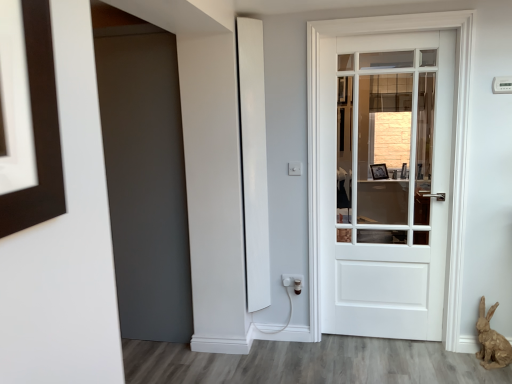
Question: Does brown papier-mâché rabbit at lower right have a smaller size compared to white plastic electric outlet at lower center?

Choices:
 (A) no
 (B) yes

Answer: (A)

Question: Could you tell me if brown papier-mâché rabbit at lower right is turned towards white plastic electric outlet at lower center?

Choices:
 (A) no
 (B) yes

Answer: (A)

Question: Considering the relative positions of brown papier-mâché rabbit at lower right and white plastic electric outlet at lower center in the image provided, is brown papier-mâché rabbit at lower right to the left of white plastic electric outlet at lower center from the viewer's perspective?

Choices:
 (A) yes
 (B) no

Answer: (B)

Question: Would you consider brown papier-mâché rabbit at lower right to be distant from white plastic electric outlet at lower center?

Choices:
 (A) yes
 (B) no

Answer: (A)

Question: Does brown papier-mâché rabbit at lower right lie in front of white plastic electric outlet at lower center?

Choices:
 (A) no
 (B) yes

Answer: (B)

Question: Is brown papier-mâché rabbit at lower right inside or outside of white matte door at center?

Choices:
 (A) inside
 (B) outside

Answer: (B)

Question: Considering the positions of brown papier-mâché rabbit at lower right and white matte door at center in the image, is brown papier-mâché rabbit at lower right wider or thinner than white matte door at center?

Choices:
 (A) thin
 (B) wide

Answer: (B)

Question: Is brown papier-mâché rabbit at lower right bigger or smaller than white matte door at center?

Choices:
 (A) big
 (B) small

Answer: (B)

Question: Considering the positions of point (480, 311) and point (343, 41), is point (480, 311) closer or farther from the camera than point (343, 41)?

Choices:
 (A) closer
 (B) farther

Answer: (B)

Question: Is brown papier-mâché rabbit at lower right wider or thinner than white plastic electric outlet at lower center?

Choices:
 (A) wide
 (B) thin

Answer: (A)

Question: From a real-world perspective, is brown papier-mâché rabbit at lower right physically located above or below white plastic electric outlet at lower center?

Choices:
 (A) above
 (B) below

Answer: (B)

Question: Is brown papier-mâché rabbit at lower right to the left or to the right of white plastic electric outlet at lower center in the image?

Choices:
 (A) right
 (B) left

Answer: (A)

Question: From the image's perspective, is brown papier-mâché rabbit at lower right positioned above or below white plastic electric outlet at lower center?

Choices:
 (A) below
 (B) above

Answer: (A)

Question: From the image's perspective, relative to brown papier-mâché rabbit at lower right, is white matte door at center above or below?

Choices:
 (A) above
 (B) below

Answer: (A)

Question: Would you say white matte door at center is inside or outside brown papier-mâché rabbit at lower right?

Choices:
 (A) outside
 (B) inside

Answer: (A)